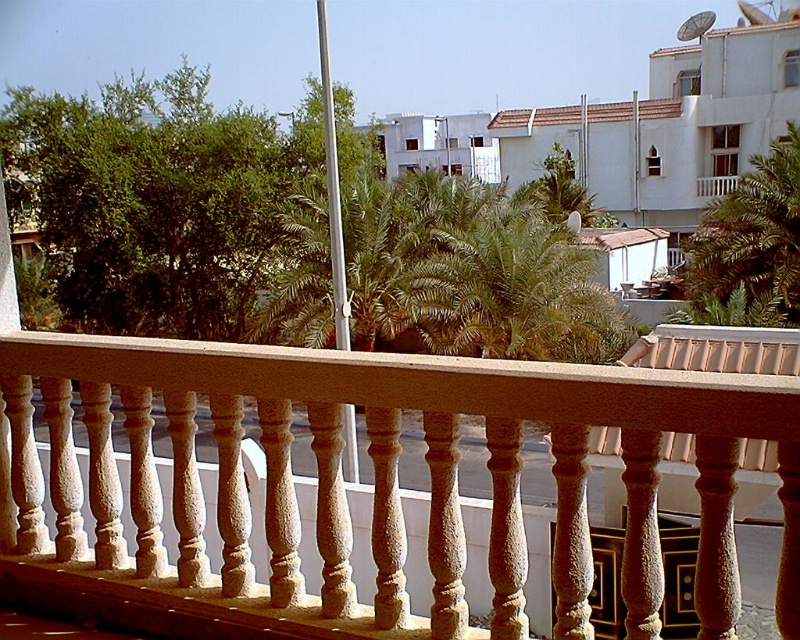
Question: Which object is positioned closest to the smooth beige balustrade at center?

Choices:
 (A) green leafy palm tree at upper right
 (B) green leafy palm tree at center
 (C) white textured balcony at upper right

Answer: (B)

Question: Does smooth beige balustrade at center appear over white textured balcony at upper right?

Choices:
 (A) no
 (B) yes

Answer: (A)

Question: Among these points, which one is farthest from the camera?

Choices:
 (A) (230, 497)
 (B) (708, 177)
 (C) (432, 292)
 (D) (786, 252)

Answer: (B)

Question: Estimate the real-world distances between objects in this image. Which object is farther from the smooth beige balustrade at center?

Choices:
 (A) white textured balcony at upper right
 (B) green leafy palm tree at center

Answer: (A)

Question: Where is smooth beige balustrade at center located in relation to white textured balcony at upper right in the image?

Choices:
 (A) right
 (B) left

Answer: (B)

Question: From the image, what is the correct spatial relationship of smooth beige balustrade at center in relation to white textured balcony at upper right?

Choices:
 (A) right
 (B) left

Answer: (B)